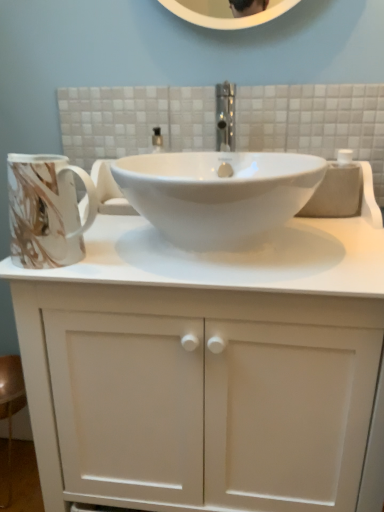
Question: Is marbled ceramic mug at left inside the boundaries of white matte cabinet at center, or outside?

Choices:
 (A) outside
 (B) inside

Answer: (B)

Question: Is marbled ceramic mug at left bigger or smaller than white matte cabinet at center?

Choices:
 (A) big
 (B) small

Answer: (B)

Question: Which is nearer to the white matte cabinet at center?

Choices:
 (A) white glossy sink at center
 (B) marbled ceramic mug at left

Answer: (A)

Question: Estimate the real-world distances between objects in this image. Which object is farther from the marbled ceramic mug at left?

Choices:
 (A) white glossy sink at center
 (B) white matte cabinet at center

Answer: (B)